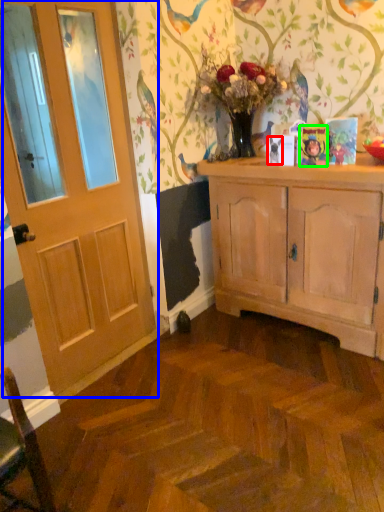
Question: Which is farther away from bird (highlighted by a red box)? door (highlighted by a blue box) or picture frame (highlighted by a green box)?

Choices:
 (A) door
 (B) picture frame

Answer: (A)